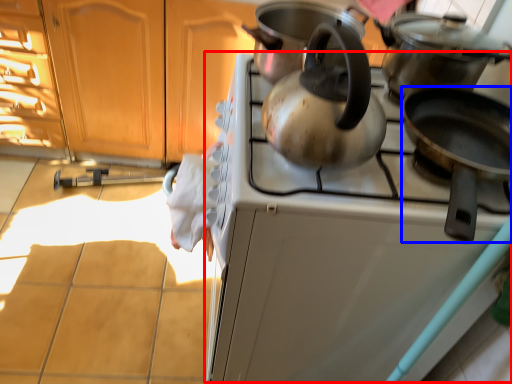
Question: Which object is further to the camera taking this photo, oven (highlighted by a red box) or kitchen appliance (highlighted by a blue box)?

Choices:
 (A) oven
 (B) kitchen appliance

Answer: (A)